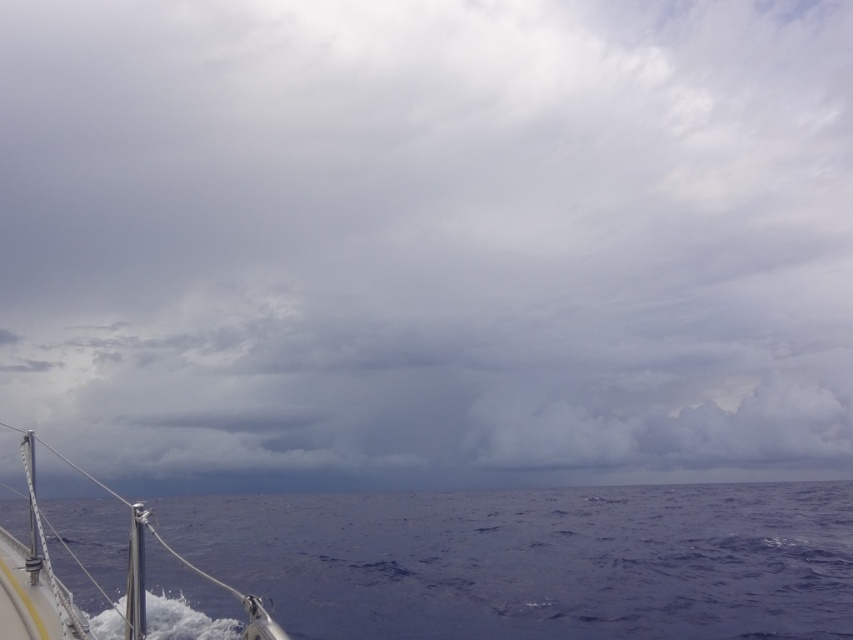
Is deep blue water at lower center thinner than polished metal boat at lower left?

No.

Can you confirm if deep blue water at lower center is positioned to the left of polished metal boat at lower left?

No, deep blue water at lower center is not to the left of polished metal boat at lower left.

Describe the element at coordinates (537, 561) in the screenshot. Image resolution: width=853 pixels, height=640 pixels. I see `deep blue water at lower center` at that location.

You are a GUI agent. You are given a task and a screenshot of the screen. Output one action in this format:
    pyautogui.click(x=<x>, y=<y>)
    Task: Click on the deep blue water at lower center
    This screenshot has height=640, width=853.
    Given the screenshot: What is the action you would take?
    pyautogui.click(x=537, y=561)